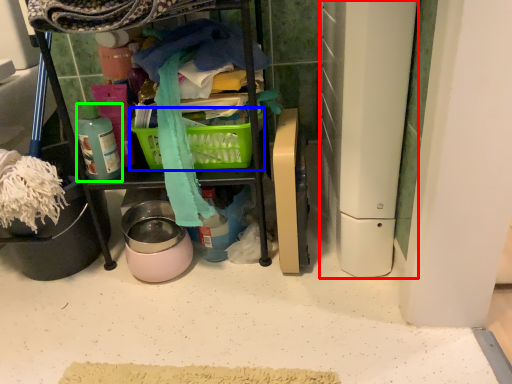
Question: Which object is the closest to the appliance (highlighted by a red box)? Choose among these: picnic basket (highlighted by a blue box) or bottle (highlighted by a green box).

Choices:
 (A) picnic basket
 (B) bottle

Answer: (A)